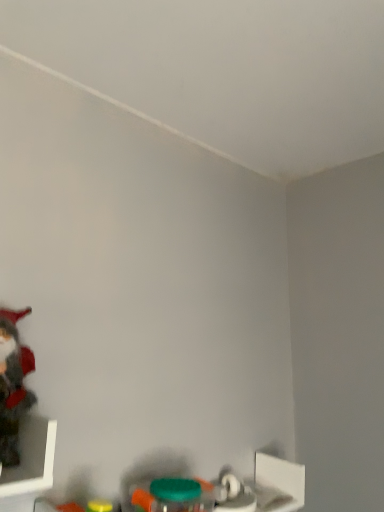
This screenshot has width=384, height=512. What do you see at coordinates (13, 384) in the screenshot?
I see `velvet plush toy at left` at bounding box center [13, 384].

Locate an element on the screen. velvet plush toy at left is located at coordinates (13, 384).

Locate an element on the screen. The height and width of the screenshot is (512, 384). velvet plush toy at left is located at coordinates (13, 384).